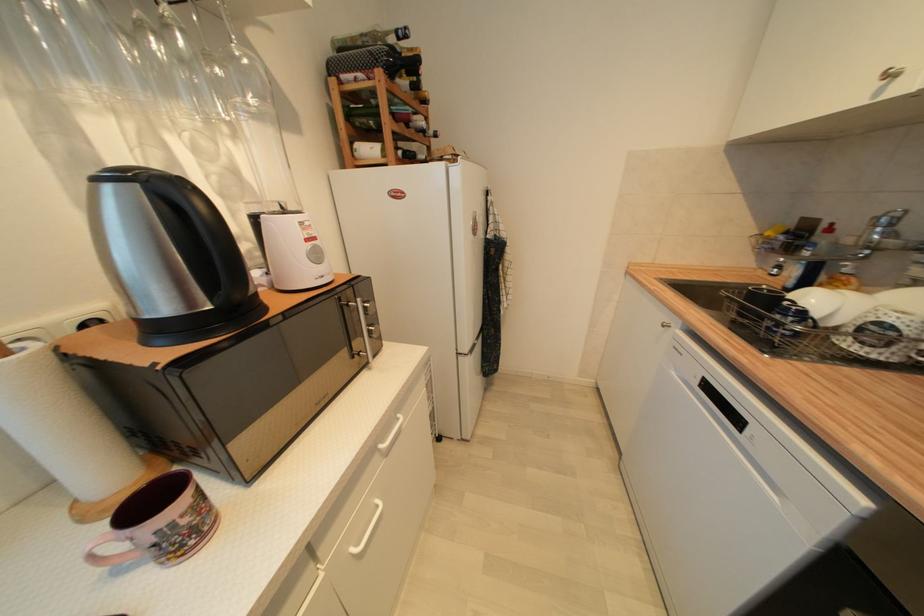
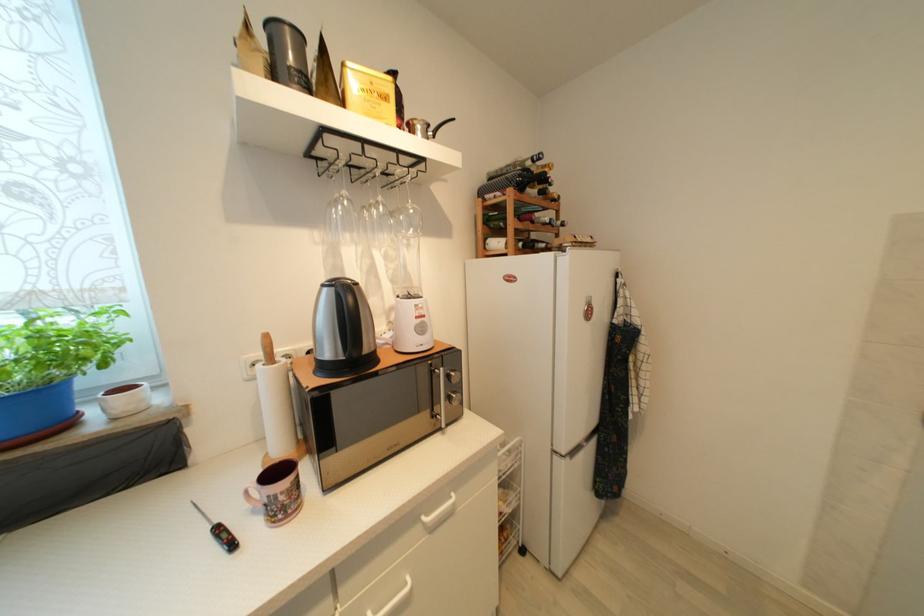
The point at (408, 84) is marked in the first image. Where is the corresponding point in the second image?

(538, 193)